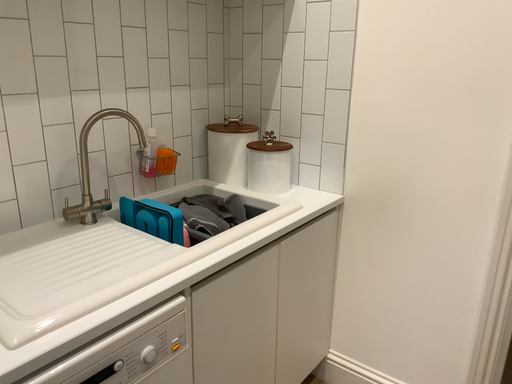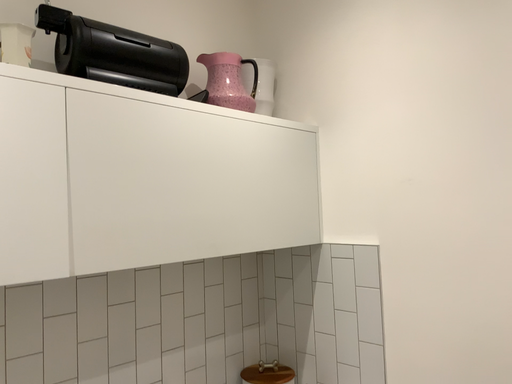
Question: How did the camera likely rotate when shooting the video?

Choices:
 (A) rotated upward
 (B) rotated downward

Answer: (A)